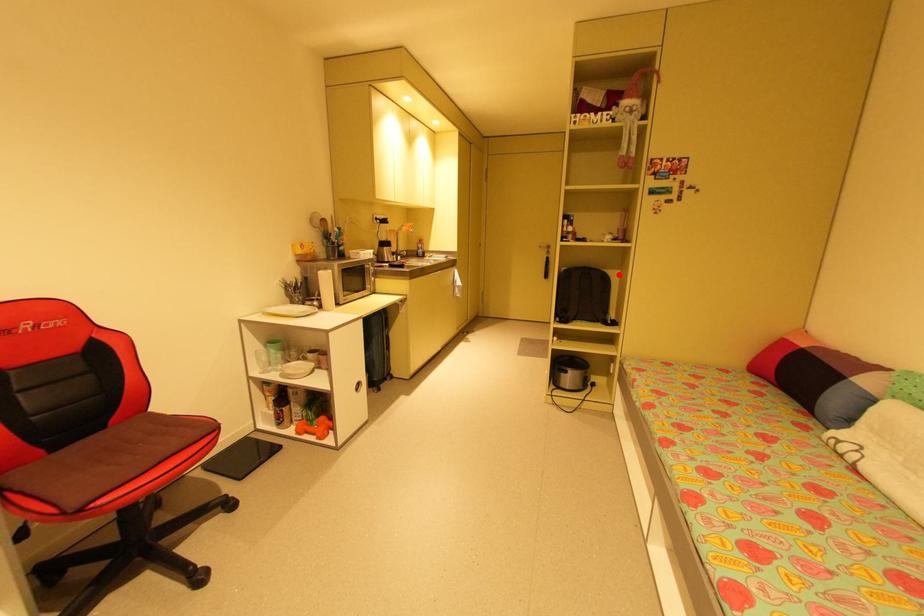
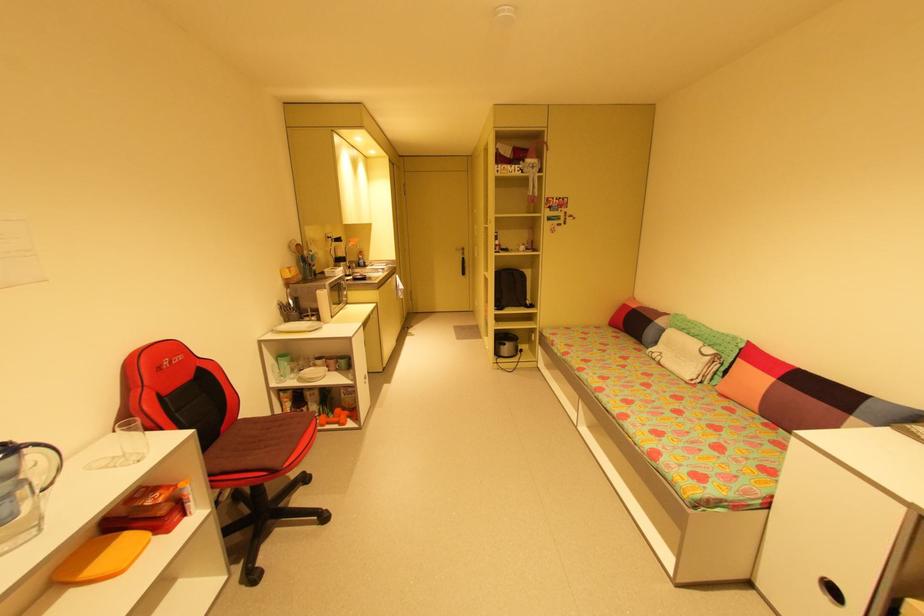
In the second image, find the point that corresponds to the highlighted location in the first image.

(532, 273)